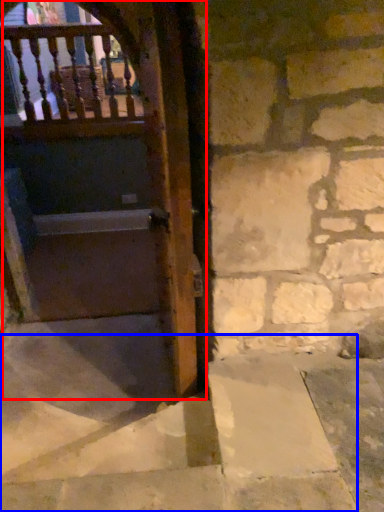
Question: Which of the following is the farthest to the observer, door (highlighted by a red box) or stairwell (highlighted by a blue box)?

Choices:
 (A) door
 (B) stairwell

Answer: (A)